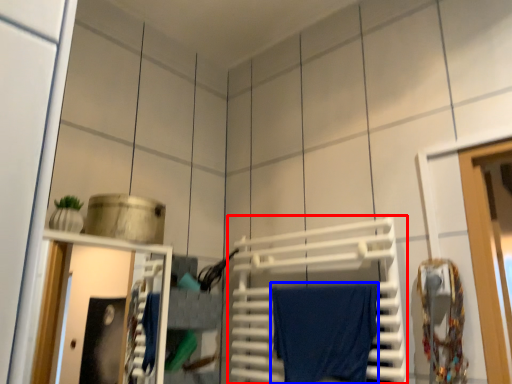
Question: Which of the following is the closest to the observer, wide (highlighted by a red box) or bath towel (highlighted by a blue box)?

Choices:
 (A) wide
 (B) bath towel

Answer: (A)